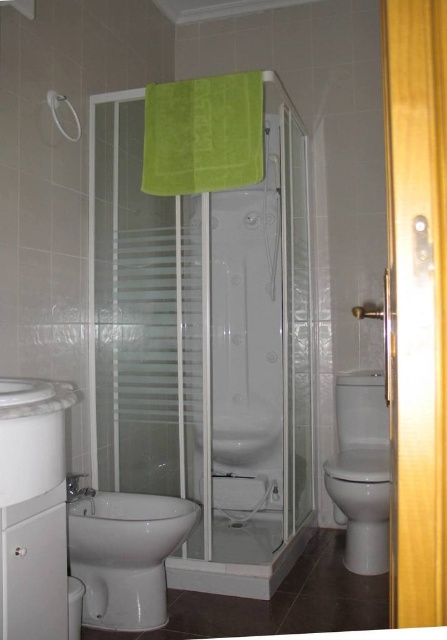
Does transparent glass shower door at center have a greater height compared to white glossy sink at lower left?

Correct, transparent glass shower door at center is much taller as white glossy sink at lower left.

The image size is (447, 640). What are the coordinates of `transparent glass shower door at center` in the screenshot? It's located at (206, 348).

Between point (190, 588) and point (54, 396), which one is positioned in front?

Point (54, 396)

Where is `transparent glass shower door at center`? This screenshot has height=640, width=447. transparent glass shower door at center is located at coordinates (206, 348).

Measure the distance between white glossy sink at lower left and white glossy shower at upper left.

A distance of 1.10 meters exists between white glossy sink at lower left and white glossy shower at upper left.

Is white glossy sink at lower left bigger than white glossy shower at upper left?

Yes.

Identify the location of white glossy sink at lower left. The width and height of the screenshot is (447, 640). (32, 435).

You are a GUI agent. You are given a task and a screenshot of the screen. Output one action in this format:
    pyautogui.click(x=<x>, y=<y>)
    Task: Click on the white glossy sink at lower left
    
    Given the screenshot: What is the action you would take?
    pyautogui.click(x=32, y=435)

Which of these two, green fabric towel at upper center or white glossy toilet at right, stands shorter?

green fabric towel at upper center

Which is above, green fabric towel at upper center or white glossy toilet at right?

Positioned higher is green fabric towel at upper center.

Locate an element on the screen. green fabric towel at upper center is located at coordinates (202, 134).